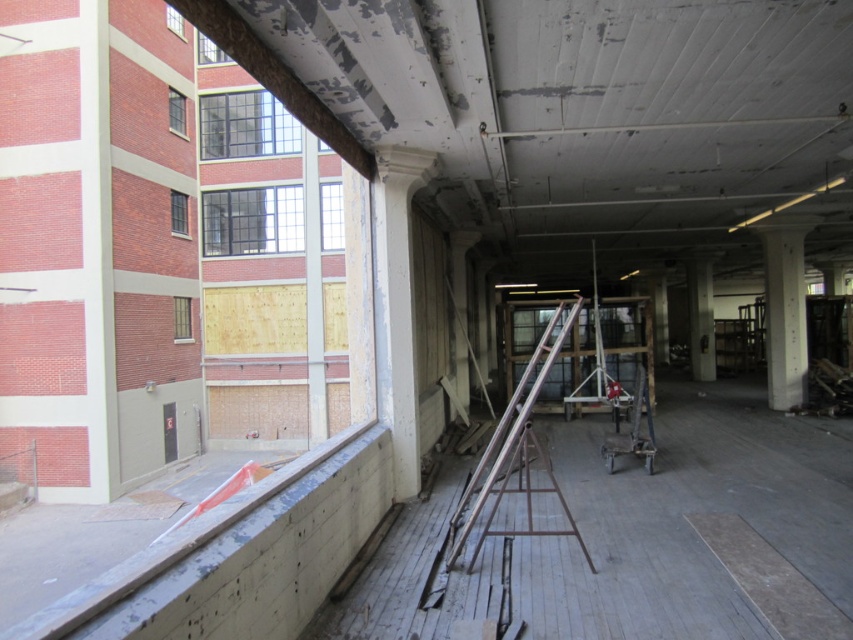
You are a painter who needs to move from the metallic silver ladder at center to the white glossy pillar at center. Given that your paint can is 1.2 meters wide, can you carry it through the space between them?

The distance between the metallic silver ladder at center and the white glossy pillar at center is 12.74 meters, which is more than enough space to carry a paint can that is 1.2 meters wide. Yes, you can move through the space between them with ease.

You are a painter who needs to move a 1.2 meter wide painting frame through the space. The metallic silver ladder at center and the white glossy pillar at center are in your way. Can you move the frame around them without tilting it?

The metallic silver ladder at center is wider than the white glossy pillar at center. Since the ladder is wider and the frame is 1.2 meters wide, you need to check if there is enough space between the ladder and other objects. If the narrowest point between them is at least 1.2 meters, the frame can pass without tilting. However, if the space is narrower than 1.2 meters, tilting might be necessary.